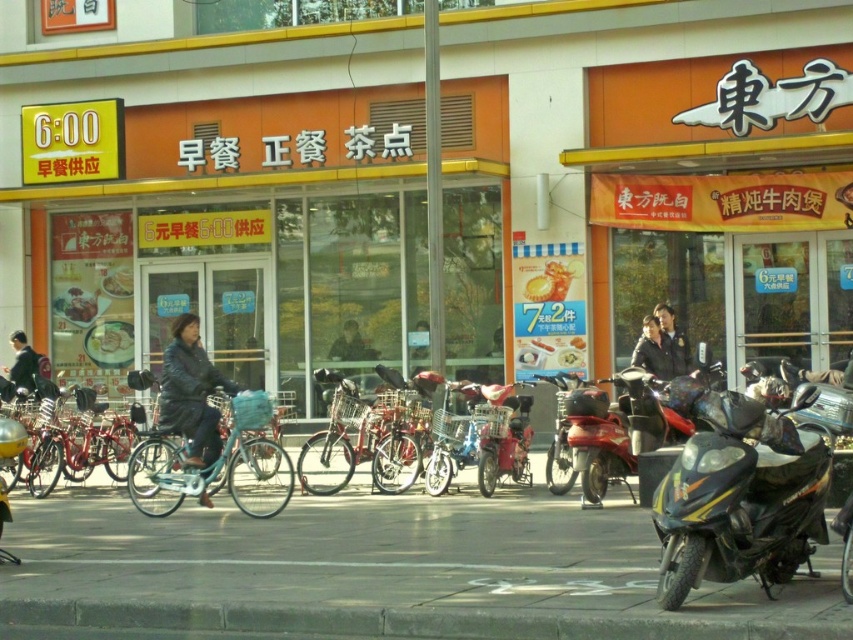
Is light blue matte bicycle at center smaller than shiny blue bicycle at center?

Actually, light blue matte bicycle at center might be larger than shiny blue bicycle at center.

From the picture: Is light blue matte bicycle at center shorter than shiny blue bicycle at center?

No, light blue matte bicycle at center is not shorter than shiny blue bicycle at center.

Who is more forward, (170, 472) or (47, 467)?

Positioned in front is point (170, 472).

Identify the location of light blue matte bicycle at center. This screenshot has height=640, width=853. click(215, 465).

Is point (273, 512) closer to viewer compared to point (349, 323)?

Yes, point (273, 512) is closer to viewer.

Does point (250, 500) come farther from viewer compared to point (350, 358)?

That is False.

Is point (270, 490) positioned behind point (369, 353)?

No, it is in front of (369, 353).

This screenshot has height=640, width=853. What are the coordinates of `light blue matte bicycle at center` in the screenshot? It's located at (215, 465).

Does dark blue leather jacket at center appear on the right side of dark blue jacket at center?

In fact, dark blue leather jacket at center is to the left of dark blue jacket at center.

Is dark blue leather jacket at center thinner than dark blue jacket at center?

In fact, dark blue leather jacket at center might be wider than dark blue jacket at center.

Identify the location of dark blue leather jacket at center. This screenshot has height=640, width=853. (190, 392).